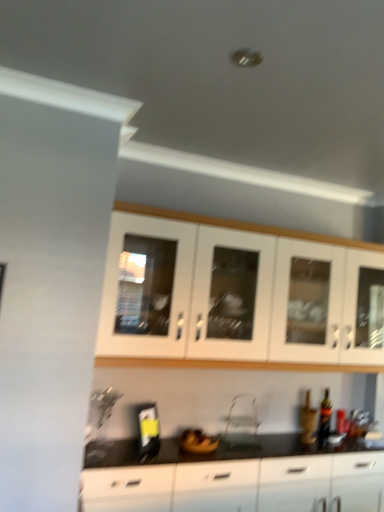
Find the location of `free point in front of matte glass bottle at lower right`. free point in front of matte glass bottle at lower right is located at coordinates point(338,447).